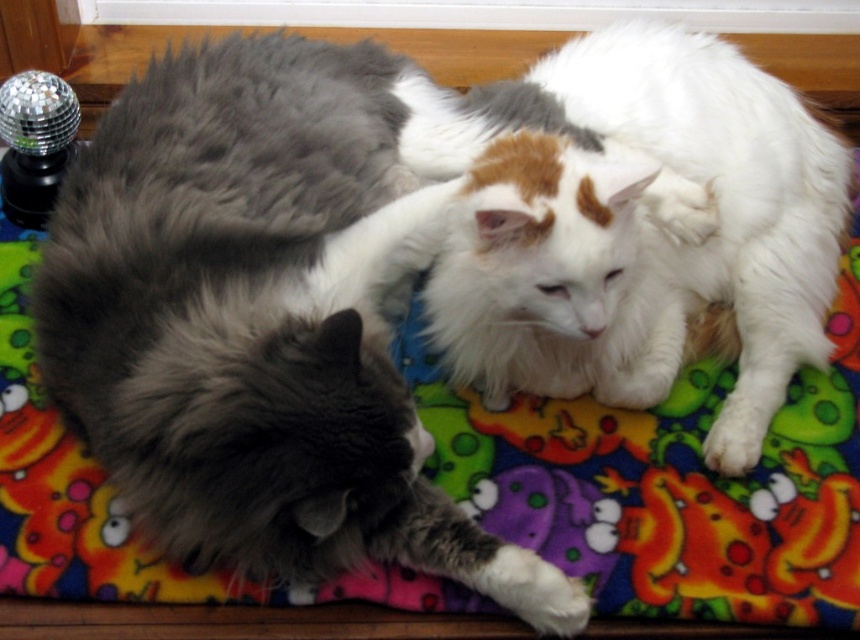
Question: Can you confirm if fluffy gray cat at center is smaller than white fluffy cat at center?

Choices:
 (A) no
 (B) yes

Answer: (A)

Question: Does fluffy gray cat at center appear on the right side of white fluffy cat at center?

Choices:
 (A) yes
 (B) no

Answer: (B)

Question: Which of the following is the closest to the observer?

Choices:
 (A) coord(268,401)
 (B) coord(513,84)

Answer: (A)

Question: From the image, what is the correct spatial relationship of fluffy gray cat at center in relation to white fluffy cat at center?

Choices:
 (A) right
 (B) left

Answer: (B)